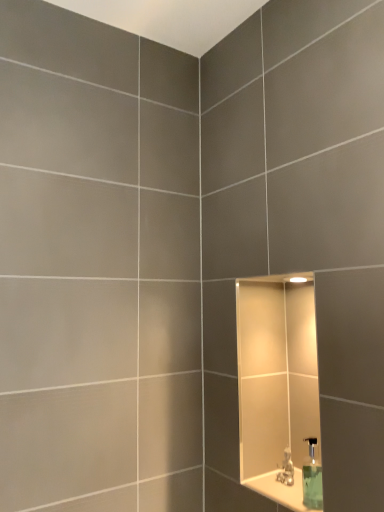
This screenshot has width=384, height=512. Find the location of `free space between green translucent soap dispenser at lower right and satin nickel faucet at lower right`. free space between green translucent soap dispenser at lower right and satin nickel faucet at lower right is located at coordinates (298, 500).